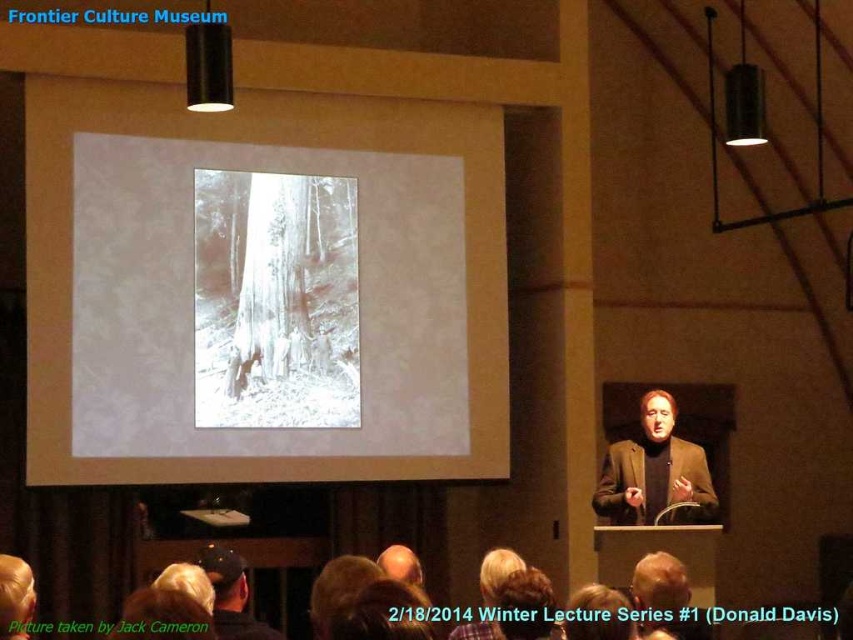
Question: From the image, what is the correct spatial relationship of brown woolen sweater at center in relation to black leather cap at lower center?

Choices:
 (A) below
 (B) above

Answer: (B)

Question: Which point is farther to the camera?

Choices:
 (A) brown woolen sweater at center
 (B) white paper at center

Answer: (B)

Question: Estimate the real-world distances between objects in this image. Which object is closer to the white paper at center?

Choices:
 (A) brown woolen sweater at center
 (B) black leather cap at lower center

Answer: (B)

Question: Is white paper at center to the left of black leather cap at lower center from the viewer's perspective?

Choices:
 (A) yes
 (B) no

Answer: (A)

Question: Which of the following is the farthest from the observer?

Choices:
 (A) black leather cap at lower center
 (B) white paper at center
 (C) brown woolen sweater at center

Answer: (B)

Question: Is brown woolen sweater at center bigger than black leather cap at lower center?

Choices:
 (A) no
 (B) yes

Answer: (B)